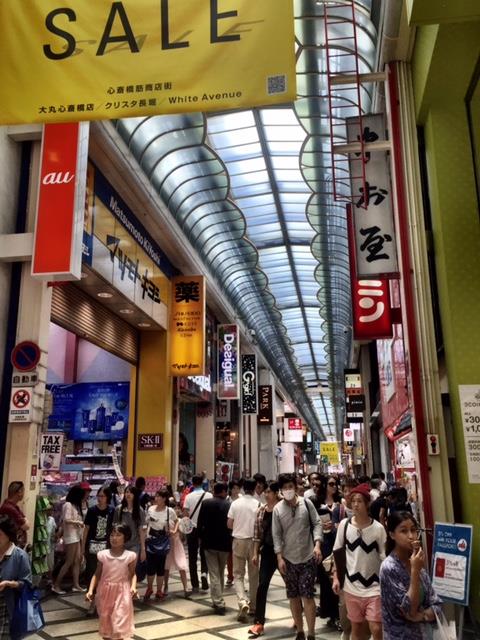
Where is `white sign on lime green wall`? white sign on lime green wall is located at coordinates (472, 428).